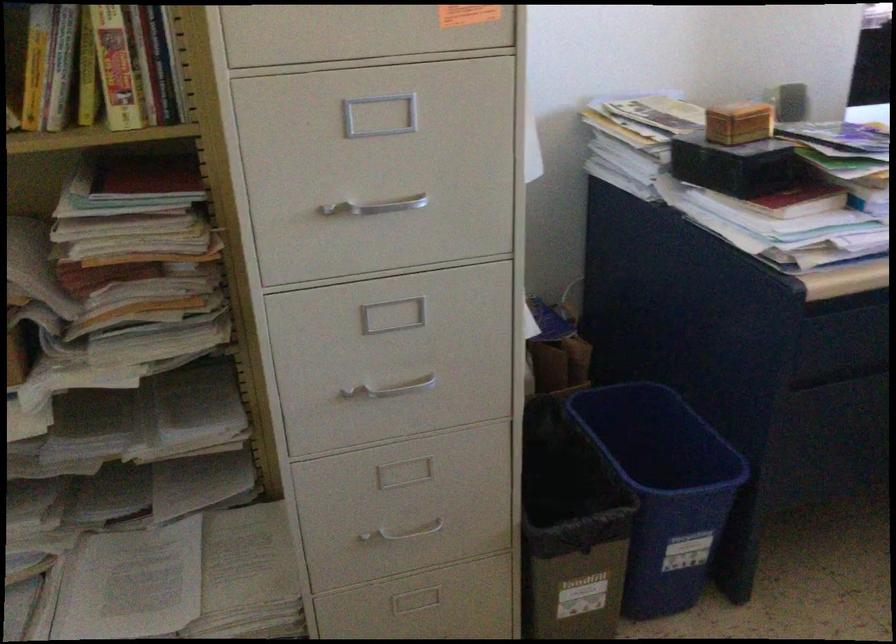
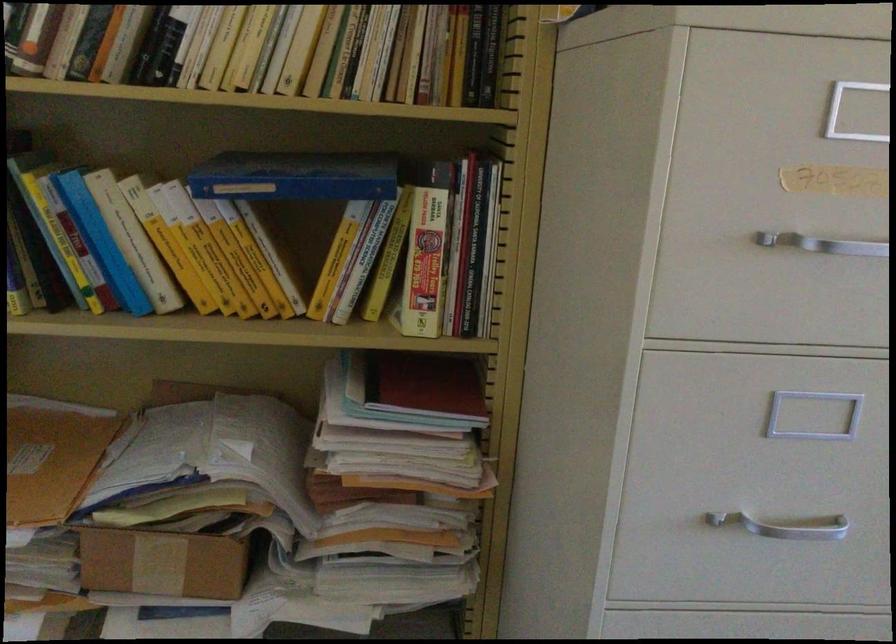
Locate, in the second image, the point that corresponds to [393,210] in the first image.

(784, 526)